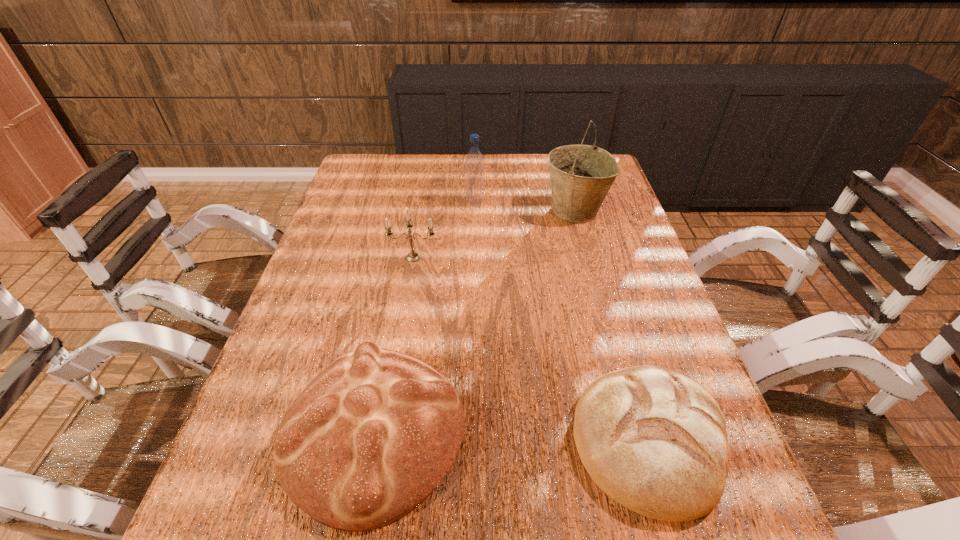
The image size is (960, 540). I want to click on vacant space located 0.370m on the right of the third shortest object, so click(574, 258).

At what (x,y) coordinates should I click in order to perform the action: click on blank area located on the right of the taller bread. Please return your answer as a coordinate pair (x, y). This screenshot has width=960, height=540. Looking at the image, I should click on (540, 433).

You are a GUI agent. You are given a task and a screenshot of the screen. Output one action in this format:
    pyautogui.click(x=<x>, y=<y>)
    Task: Click on the free region located 0.290m on the left of the shorter bread
    The image size is (960, 540).
    Given the screenshot: What is the action you would take?
    pyautogui.click(x=417, y=440)

Identify the location of object that is at the left edge. (373, 434).

Find the location of a particular element. The height and width of the screenshot is (540, 960). wine bucket present at the right edge is located at coordinates (581, 175).

Locate an element on the screen. This screenshot has width=960, height=540. bread situated at the right edge is located at coordinates (653, 439).

Locate an element on the screen. This screenshot has width=960, height=540. object that is at the near left corner is located at coordinates (373, 434).

I want to click on object at the near right corner, so click(x=653, y=439).

This screenshot has width=960, height=540. In the image, there is a desktop. What are the coordinates of `free space at the far edge` in the screenshot? It's located at (406, 181).

Image resolution: width=960 pixels, height=540 pixels. Find the location of `free space at the left edge`. free space at the left edge is located at coordinates (300, 344).